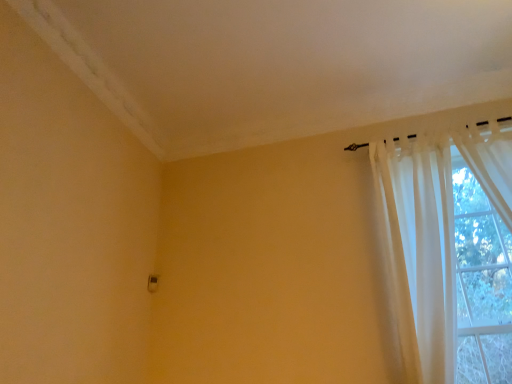
Identify the location of white sheer curtain at right. This screenshot has width=512, height=384. (419, 251).

The width and height of the screenshot is (512, 384). What do you see at coordinates (419, 251) in the screenshot?
I see `white sheer curtain at right` at bounding box center [419, 251].

Locate an element on the screen. The width and height of the screenshot is (512, 384). white sheer curtain at right is located at coordinates (419, 251).